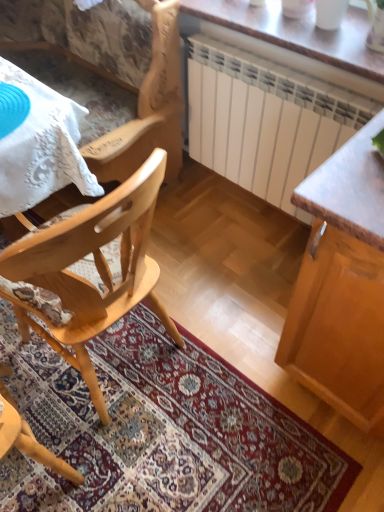
The width and height of the screenshot is (384, 512). What are the coordinates of `free space to the right of natural wood chair at left, which is counted as the first chair, starting from the bottom` in the screenshot? It's located at (215, 394).